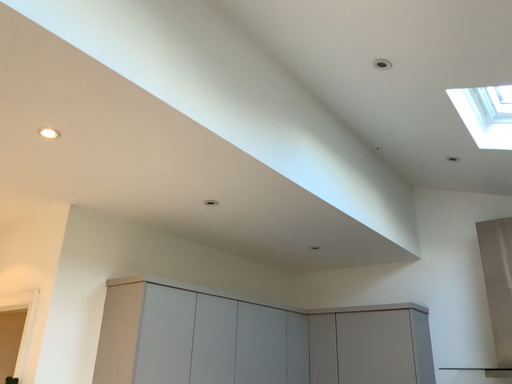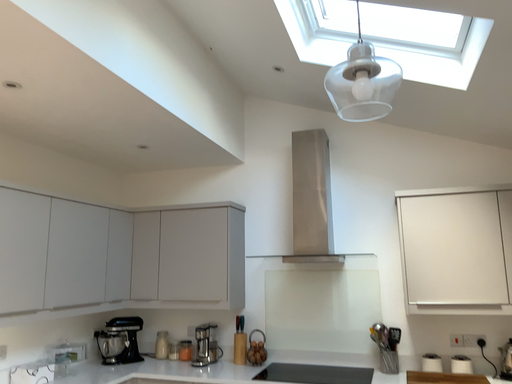
Question: How did the camera likely rotate when shooting the video?

Choices:
 (A) rotated right
 (B) rotated left

Answer: (A)